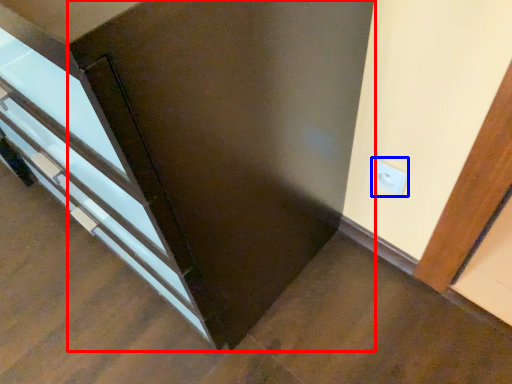
Question: Which of the following is the farthest to the observer, door (highlighted by a red box) or electric outlet (highlighted by a blue box)?

Choices:
 (A) door
 (B) electric outlet

Answer: (B)